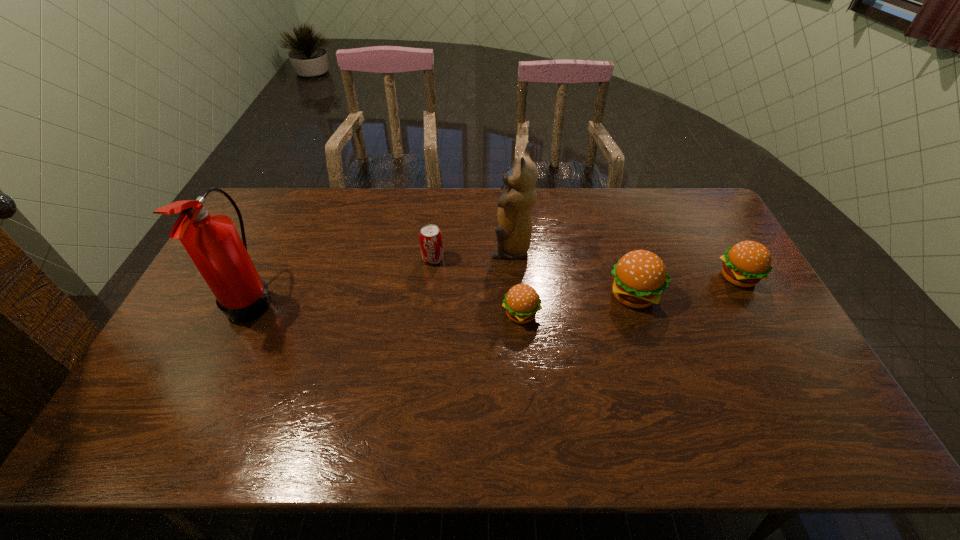
Where is `vacant area situated on the back of the fifth object from left to right`? vacant area situated on the back of the fifth object from left to right is located at coordinates (622, 259).

I want to click on free space located on the left of the rightmost hamburger, so click(664, 277).

Locate an element on the screen. The image size is (960, 540). vacant region located at the spray nozzle of the fire extinguisher is located at coordinates (406, 299).

The height and width of the screenshot is (540, 960). I want to click on free spot located on the left of the second object from left to right, so click(x=360, y=259).

Find the location of a particular element. Image resolution: width=960 pixels, height=540 pixels. free spot located 0.070m on the face of the cat is located at coordinates (470, 248).

Locate an element on the screen. vacant area situated on the face of the cat is located at coordinates (416, 248).

The height and width of the screenshot is (540, 960). I want to click on vacant position located on the face of the cat, so click(x=383, y=248).

Where is `object that is at the left edge`? This screenshot has height=540, width=960. object that is at the left edge is located at coordinates pyautogui.click(x=211, y=240).

Where is `object situated at the right edge`? Image resolution: width=960 pixels, height=540 pixels. object situated at the right edge is located at coordinates (746, 263).

The height and width of the screenshot is (540, 960). In the image, there is a desktop. In order to click on vacant space at the far edge in this screenshot , I will do pyautogui.click(x=392, y=202).